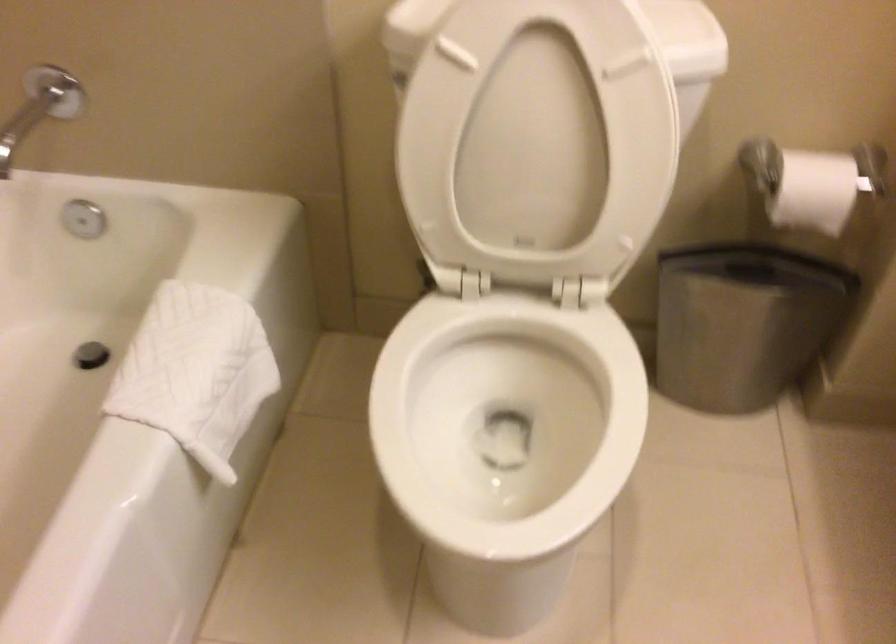
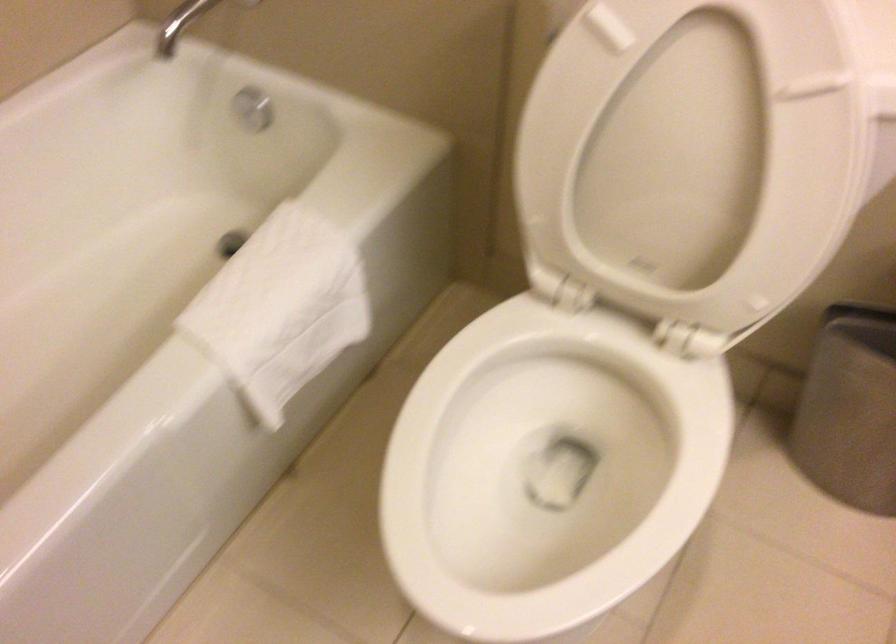
Find the pixel in the second image that matches point (87, 218) in the first image.

(252, 108)